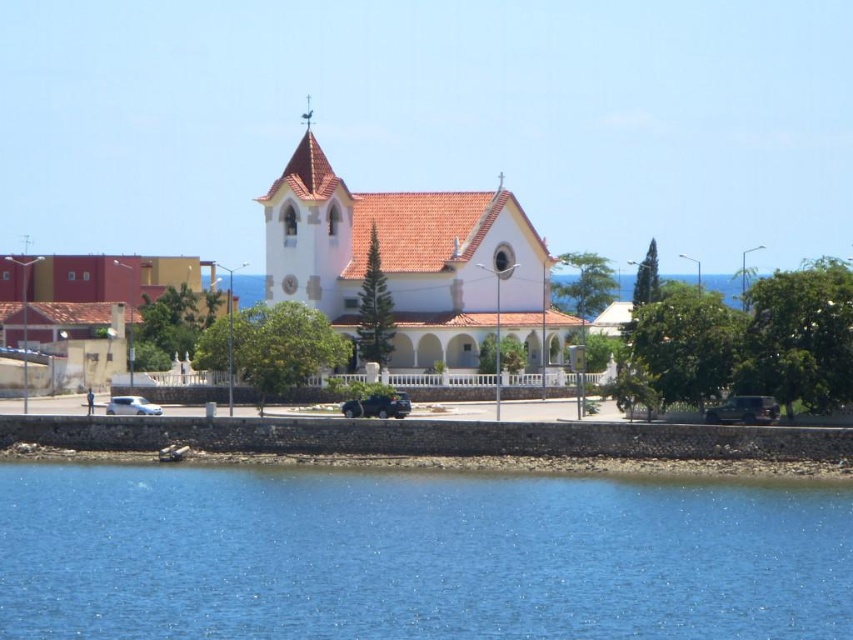
Who is more distant from viewer, (x=378, y=568) or (x=459, y=317)?

Point (x=459, y=317)

You are a GUI agent. You are given a task and a screenshot of the screen. Output one action in this format:
    pyautogui.click(x=<x>, y=<y>)
    Task: Click on the blue liquid water at lower center
    The width and height of the screenshot is (853, 640).
    Given the screenshot: What is the action you would take?
    pyautogui.click(x=415, y=556)